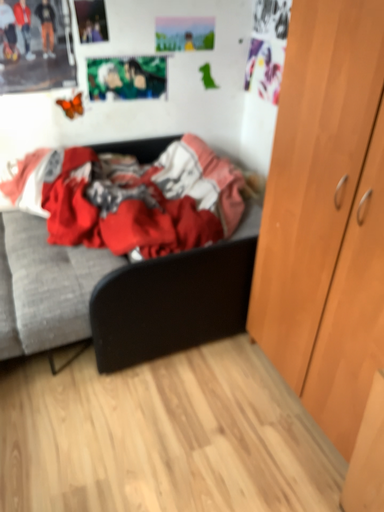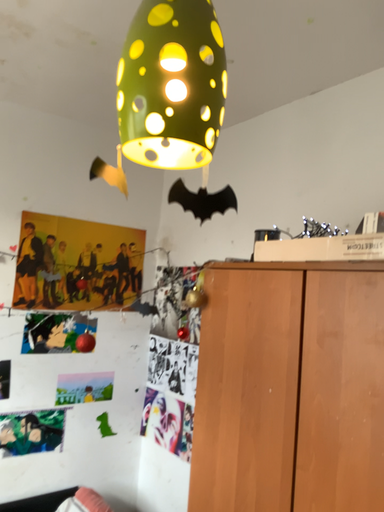
Question: How did the camera likely rotate when shooting the video?

Choices:
 (A) rotated left
 (B) rotated right

Answer: (B)